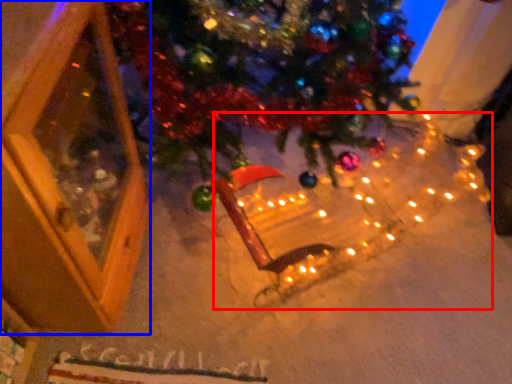
Question: Which object appears closest to the camera in this image, christmas light (highlighted by a red box) or screen door (highlighted by a blue box)?

Choices:
 (A) christmas light
 (B) screen door

Answer: (B)